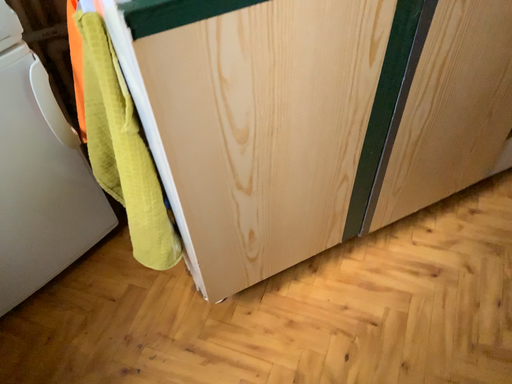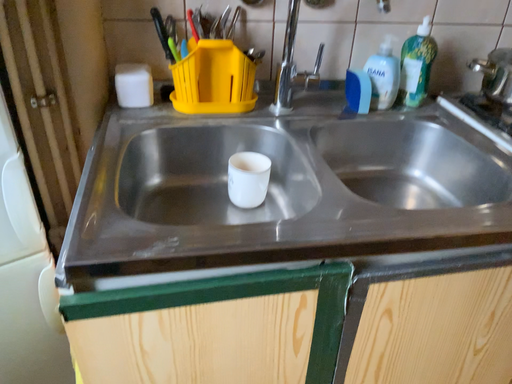
Question: Which way did the camera rotate in the video?

Choices:
 (A) rotated left
 (B) rotated right

Answer: (A)